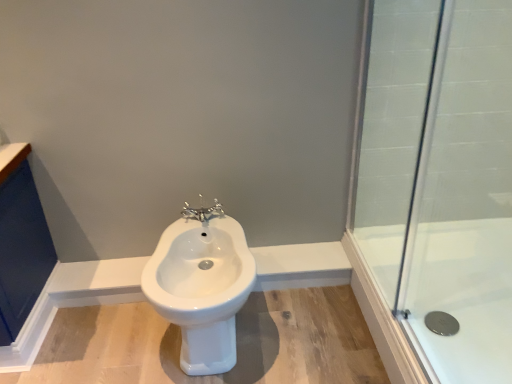
Question: From a real-world perspective, is clear glass shower at right positioned above or below white glossy bidet at center?

Choices:
 (A) below
 (B) above

Answer: (A)

Question: Is clear glass shower at right inside the boundaries of white glossy bidet at center, or outside?

Choices:
 (A) outside
 (B) inside

Answer: (A)

Question: Based on their relative distances, which object is farther from the chrome metallic faucet at center?

Choices:
 (A) clear glass shower at right
 (B) white glossy bidet at center
 (C) transparent glass shower door at right

Answer: (A)

Question: Considering the real-world distances, which object is closest to the white glossy bidet at center?

Choices:
 (A) transparent glass shower door at right
 (B) clear glass shower at right
 (C) chrome metallic faucet at center

Answer: (C)